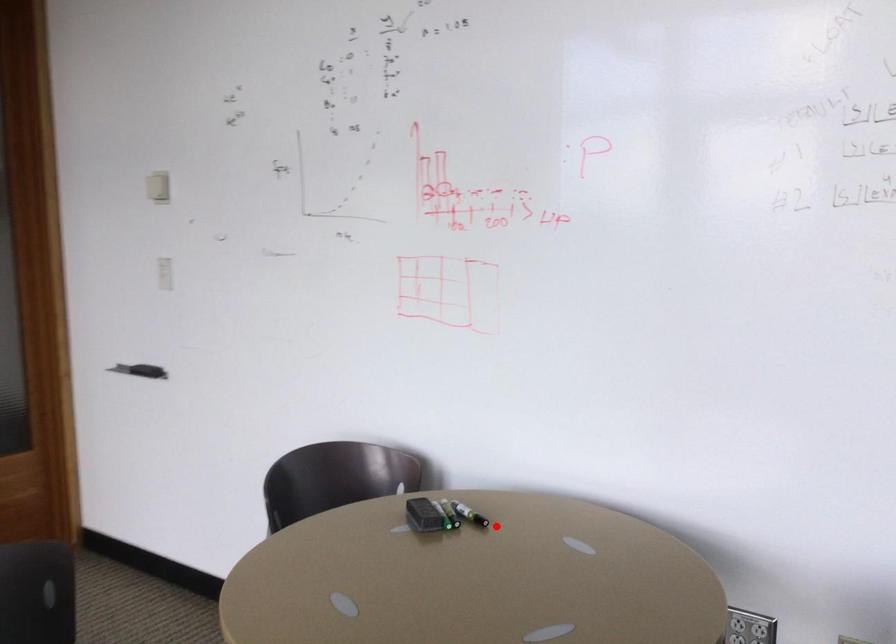
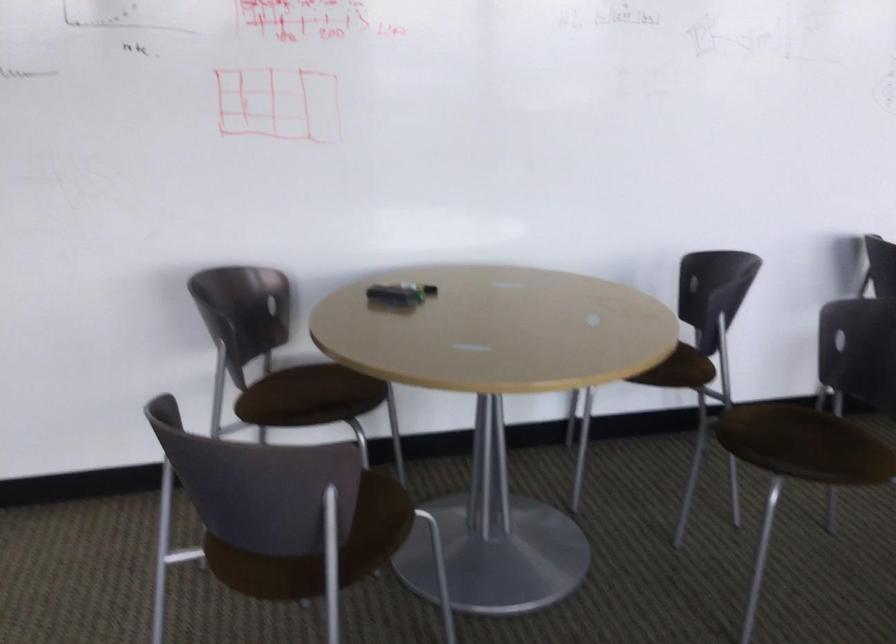
The point at the highlighted location is marked in the first image. Where is the corresponding point in the second image?

(433, 290)